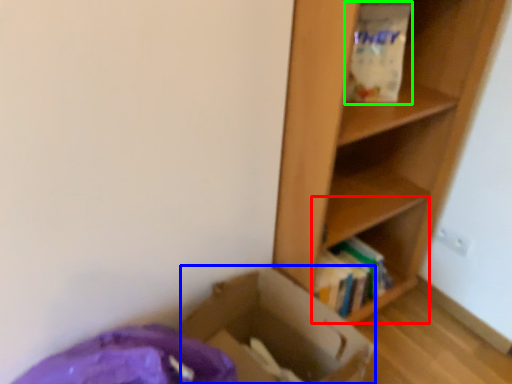
Question: Considering the real-world distances, which object is farthest from cabinet (highlighted by a red box)? cardboard box (highlighted by a blue box) or paper bag (highlighted by a green box)?

Choices:
 (A) cardboard box
 (B) paper bag

Answer: (B)